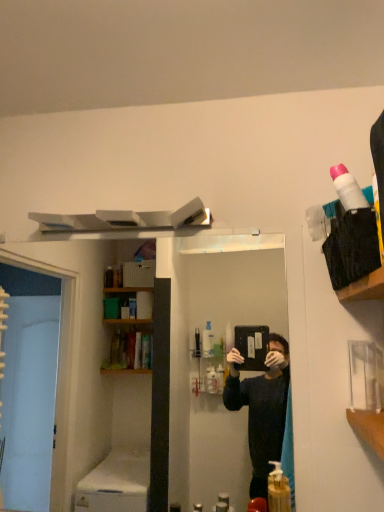
The width and height of the screenshot is (384, 512). Find the location of `white matte soap dispenser at lower center`. white matte soap dispenser at lower center is located at coordinates (198, 507).

The image size is (384, 512). What do you see at coordinates (198, 507) in the screenshot?
I see `white matte soap dispenser at lower center` at bounding box center [198, 507].

You are a GUI agent. You are given a task and a screenshot of the screen. Output one action in this format:
    pyautogui.click(x=<x>, y=<y>)
    Task: Click on the translucent yellow liquid at lower center
    The image size is (384, 512).
    Given the screenshot: What is the action you would take?
    pyautogui.click(x=278, y=490)

Image resolution: width=384 pixels, height=512 pixels. Describe the element at coordinates (278, 490) in the screenshot. I see `translucent yellow liquid at lower center` at that location.

Measure the distance between translucent yellow liquid at lower center and camera.

A distance of 1.11 meters exists between translucent yellow liquid at lower center and camera.

The height and width of the screenshot is (512, 384). Identify the location of white matte soap dispenser at lower center. pos(198,507).

In the image, is white matte soap dispenser at lower center on the left side or the right side of translucent yellow liquid at lower center?

From the image, it's evident that white matte soap dispenser at lower center is to the left of translucent yellow liquid at lower center.

Which object is further away from the camera, white matte soap dispenser at lower center or translucent yellow liquid at lower center?

Positioned behind is white matte soap dispenser at lower center.

Considering the points (201, 505) and (280, 490), which point is behind, point (201, 505) or point (280, 490)?

The point (201, 505) is farther.

From the image's perspective, is white matte soap dispenser at lower center positioned above or below translucent yellow liquid at lower center?

white matte soap dispenser at lower center is situated lower than translucent yellow liquid at lower center in the image.

From a real-world perspective, does white matte soap dispenser at lower center stand above translucent yellow liquid at lower center?

No.

Which of these two, white matte soap dispenser at lower center or translucent yellow liquid at lower center, is thinner?

With smaller width is white matte soap dispenser at lower center.

Between white matte soap dispenser at lower center and translucent yellow liquid at lower center, which one has less height?

With less height is white matte soap dispenser at lower center.

Considering the sizes of white matte soap dispenser at lower center and translucent yellow liquid at lower center in the image, is white matte soap dispenser at lower center bigger or smaller than translucent yellow liquid at lower center?

In the image, white matte soap dispenser at lower center appears to be smaller than translucent yellow liquid at lower center.

Can we say white matte soap dispenser at lower center lies outside translucent yellow liquid at lower center?

Yes, white matte soap dispenser at lower center is outside of translucent yellow liquid at lower center.

Is white matte soap dispenser at lower center in contact with translucent yellow liquid at lower center?

white matte soap dispenser at lower center and translucent yellow liquid at lower center are not in contact.

Could you tell me if white matte soap dispenser at lower center is turned towards translucent yellow liquid at lower center?

No, white matte soap dispenser at lower center is not aimed at translucent yellow liquid at lower center.

Can you tell me how much white matte soap dispenser at lower center and translucent yellow liquid at lower center differ in facing direction?

0.00283 degrees separate the facing orientations of white matte soap dispenser at lower center and translucent yellow liquid at lower center.

Could you measure the distance between white matte soap dispenser at lower center and translucent yellow liquid at lower center?

The distance of white matte soap dispenser at lower center from translucent yellow liquid at lower center is 6.20 feet.

The image size is (384, 512). I want to click on toiletry on the left of the translucent yellow liquid at lower center, so click(x=198, y=507).

Between translucent yellow liquid at lower center and white matte soap dispenser at lower center, which one appears on the right side from the viewer's perspective?

translucent yellow liquid at lower center.

Relative to white matte soap dispenser at lower center, is translucent yellow liquid at lower center in front or behind?

In the image, translucent yellow liquid at lower center appears in front of white matte soap dispenser at lower center.

Is point (279, 467) in front of point (194, 509)?

Yes, it is.

In the scene shown: From the image's perspective, which one is positioned lower, translucent yellow liquid at lower center or white matte soap dispenser at lower center?

white matte soap dispenser at lower center.

Consider the image. From a real-world perspective, between translucent yellow liquid at lower center and white matte soap dispenser at lower center, who is vertically higher?

From a 3D spatial view, translucent yellow liquid at lower center is above.

Which object is thinner, translucent yellow liquid at lower center or white matte soap dispenser at lower center?

Thinner between the two is white matte soap dispenser at lower center.

Considering the sizes of objects translucent yellow liquid at lower center and white matte soap dispenser at lower center in the image provided, who is taller, translucent yellow liquid at lower center or white matte soap dispenser at lower center?

translucent yellow liquid at lower center is taller.

Considering the sizes of objects translucent yellow liquid at lower center and white matte soap dispenser at lower center in the image provided, who is bigger, translucent yellow liquid at lower center or white matte soap dispenser at lower center?

Bigger between the two is translucent yellow liquid at lower center.

Looking at this image, would you say translucent yellow liquid at lower center is outside white matte soap dispenser at lower center?

That's correct, translucent yellow liquid at lower center is outside of white matte soap dispenser at lower center.

Is translucent yellow liquid at lower center not near white matte soap dispenser at lower center?

Yes, translucent yellow liquid at lower center and white matte soap dispenser at lower center are located far from each other.

Is translucent yellow liquid at lower center looking in the opposite direction of white matte soap dispenser at lower center?

translucent yellow liquid at lower center is not turned away from white matte soap dispenser at lower center.

The image size is (384, 512). I want to click on cleaning product located on the right of white matte soap dispenser at lower center, so click(278, 490).

In the image, there is a white matte soap dispenser at lower center. Where is `cleaning product above it (from the image's perspective)`? This screenshot has height=512, width=384. cleaning product above it (from the image's perspective) is located at coordinates (278, 490).

The image size is (384, 512). In order to click on toiletry below the translucent yellow liquid at lower center (from the image's perspective) in this screenshot , I will do `click(198, 507)`.